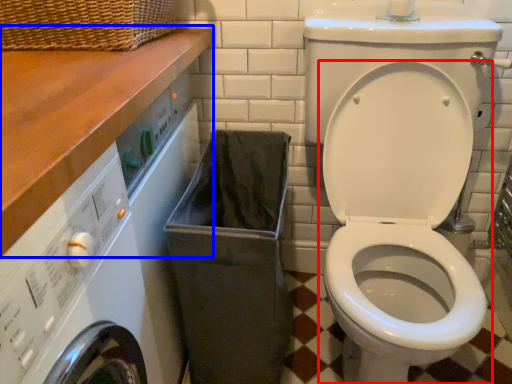
Question: Which point is further to the camera, toilet (highlighted by a red box) or counter top (highlighted by a blue box)?

Choices:
 (A) toilet
 (B) counter top

Answer: (A)